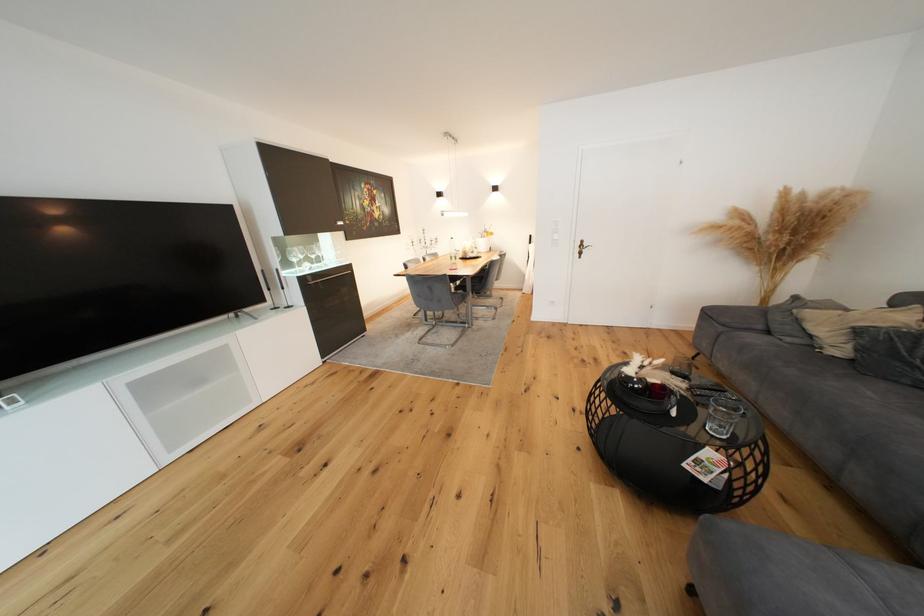
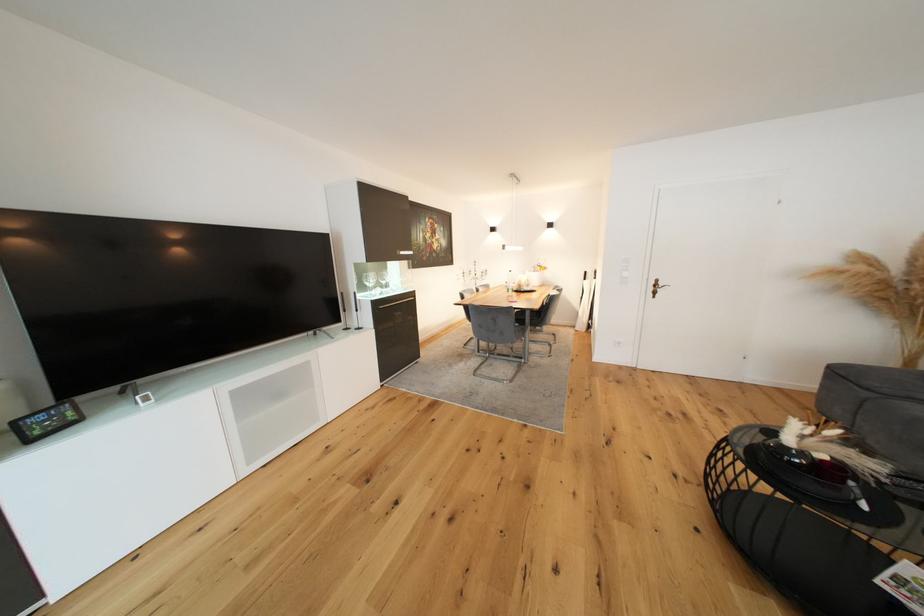
Where in the second image is the point corresponding to (637,379) from the first image?

(792, 450)